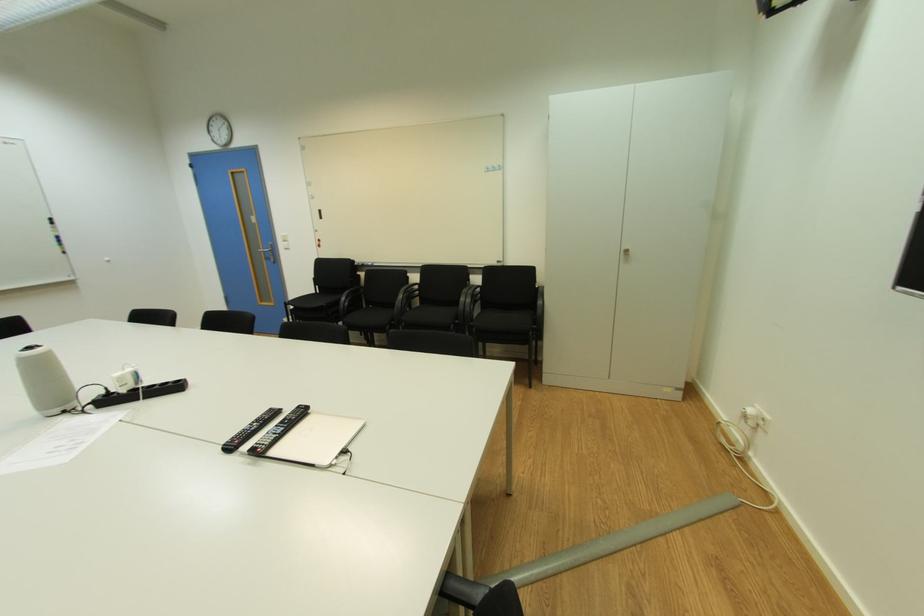
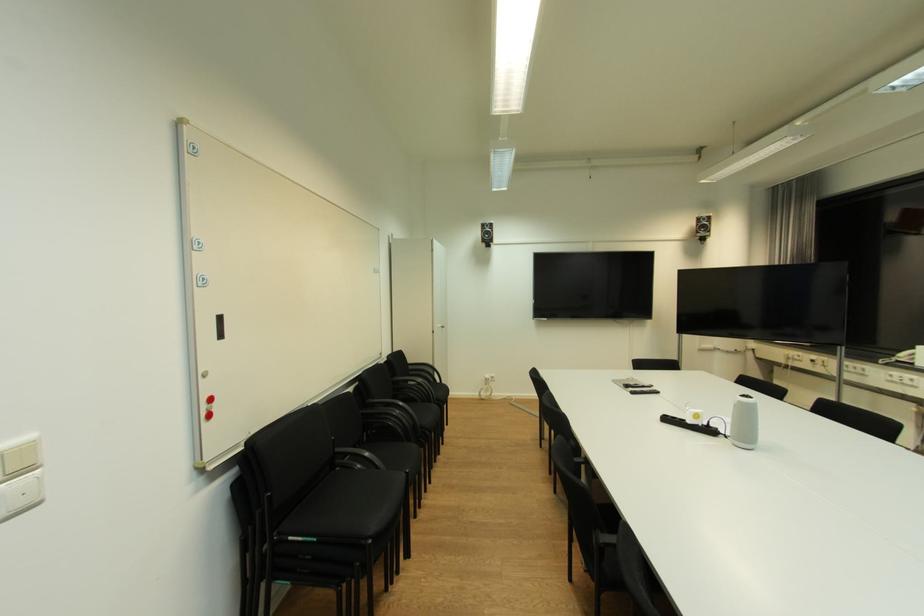
The point at [180,387] is marked in the first image. Where is the corresponding point in the second image?

(674, 421)